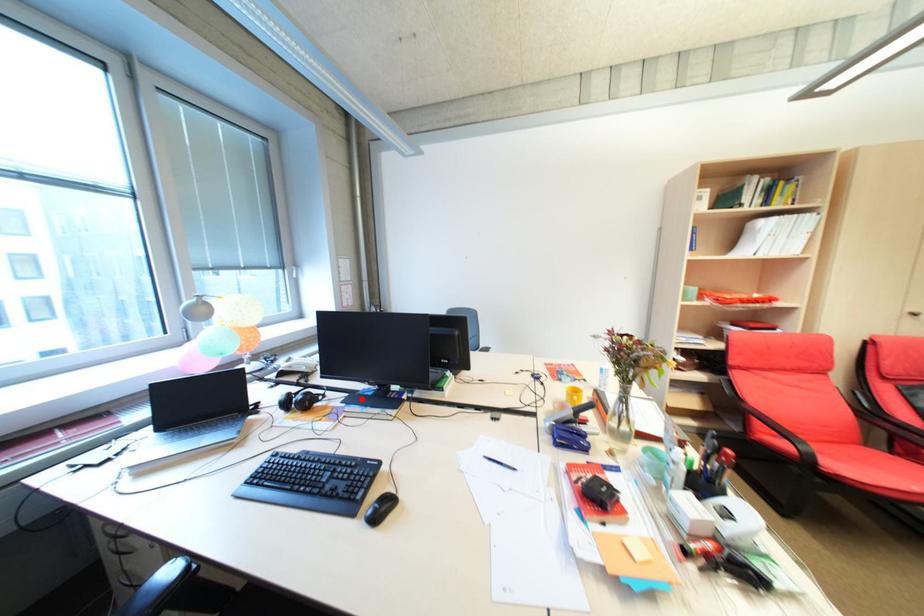
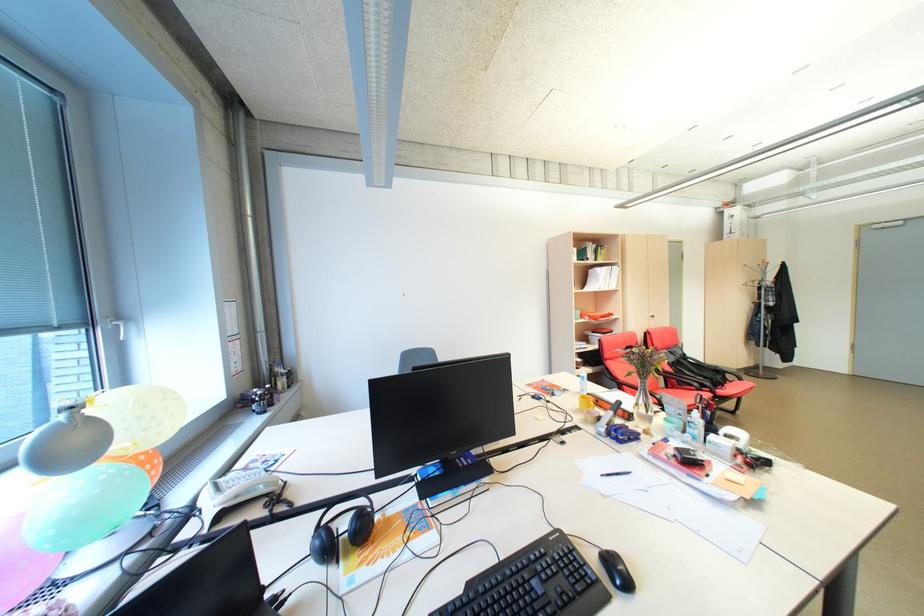
Find the pixel in the second image that matches the highlighted location in the first image.

(435, 488)